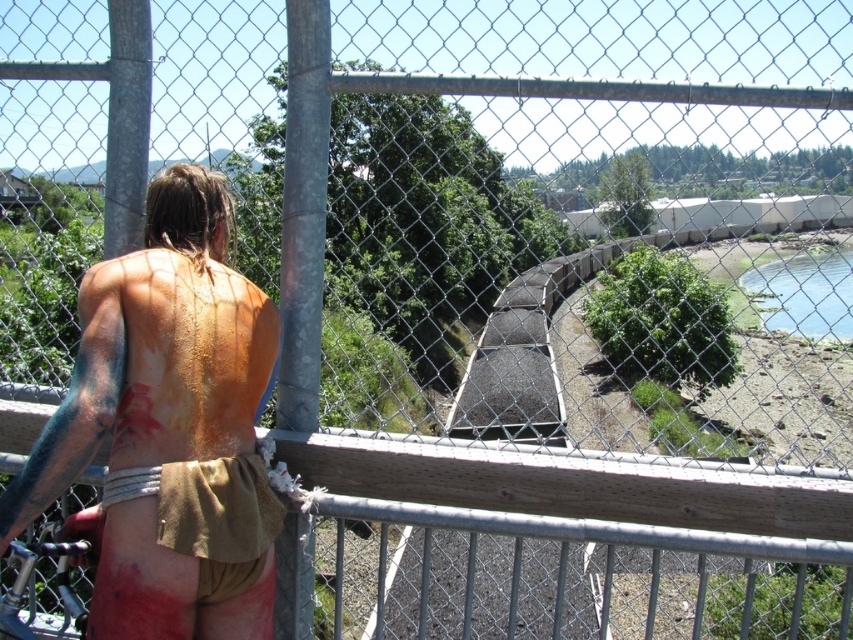
Question: Which of the following is the closest to the observer?

Choices:
 (A) (123, 509)
 (B) (792, 317)

Answer: (A)

Question: Where is brown leather shorts at left located in relation to green grassy river at lower right in the image?

Choices:
 (A) left
 (B) right

Answer: (A)

Question: Among these points, which one is farthest from the camera?

Choices:
 (A) (97, 550)
 (B) (764, 264)

Answer: (B)

Question: Is brown leather shorts at left below green grassy river at lower right?

Choices:
 (A) no
 (B) yes

Answer: (B)

Question: Which object is farther from the camera taking this photo?

Choices:
 (A) brown leather shorts at left
 (B) green grassy river at lower right

Answer: (B)

Question: Does brown leather shorts at left have a lesser width compared to green grassy river at lower right?

Choices:
 (A) yes
 (B) no

Answer: (A)